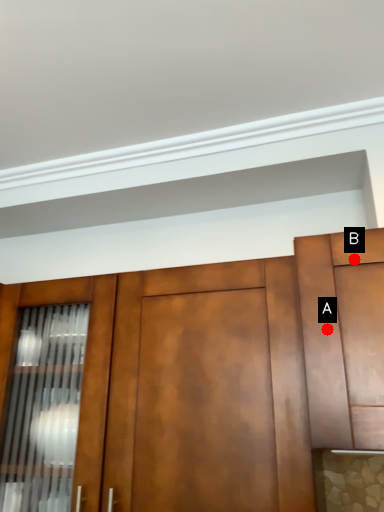
Question: Two points are circled on the image, labeled by A and B beside each circle. Which point appears closest to the camera in this image?

Choices:
 (A) A is closer
 (B) B is closer

Answer: (A)